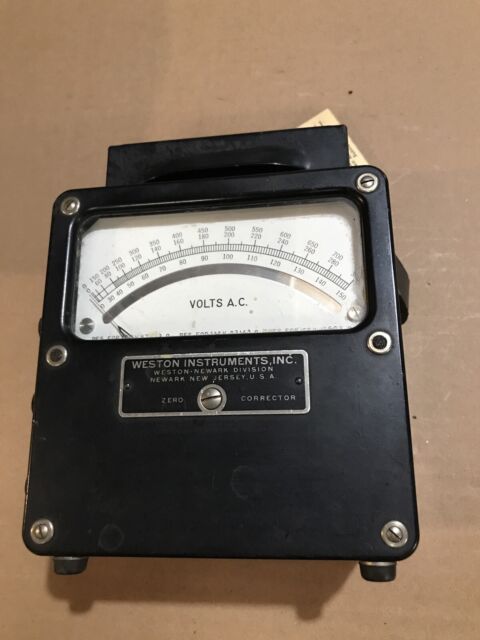
This screenshot has height=640, width=480. I want to click on wall, so click(x=240, y=95).